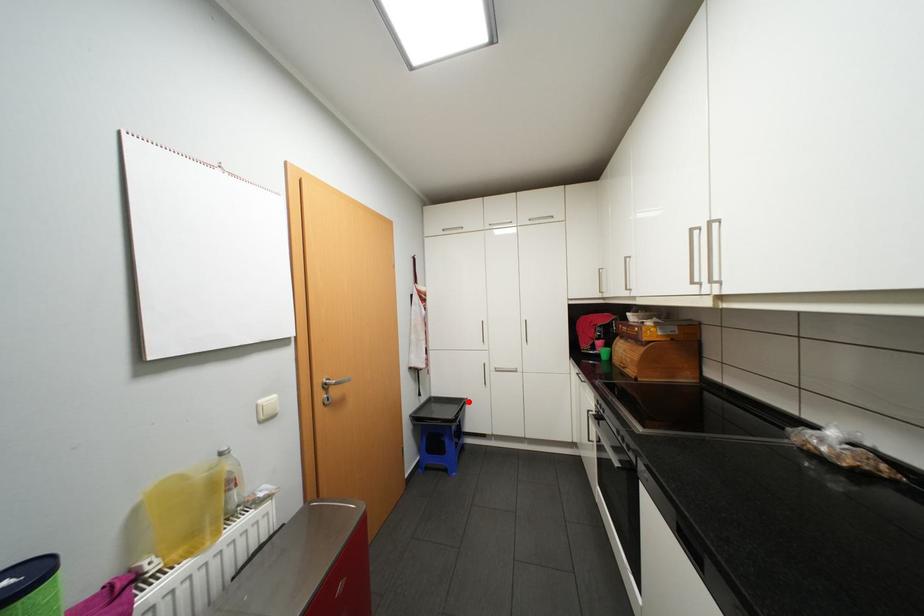
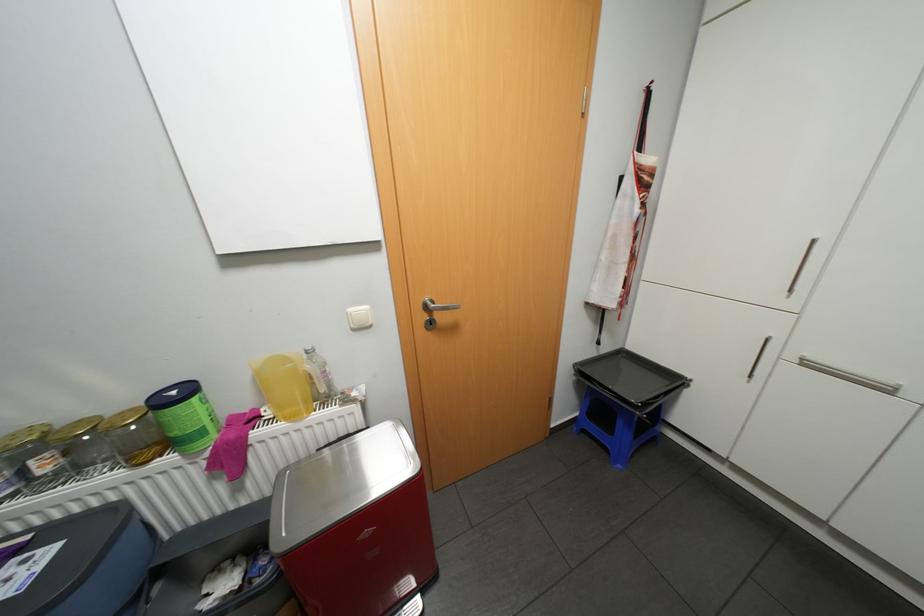
Question: A red point is marked in image1. In image2, is the corresponding 3D point closer to the camera or farther? Reply with the corresponding letter.

Choices:
 (A) The corresponding 3D point is closer.
 (B) The corresponding 3D point is farther.

Answer: (A)